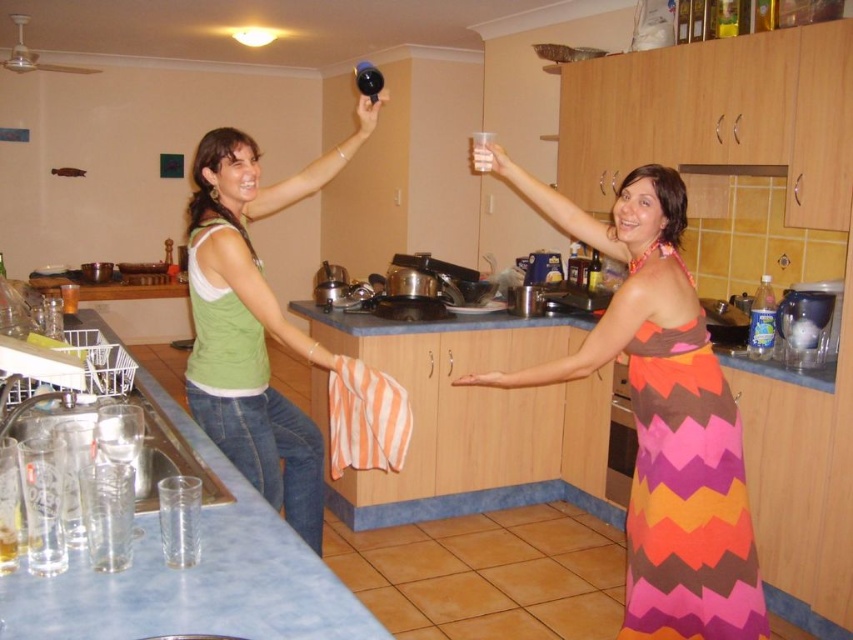
In the scene shown: Can you confirm if multicolored woven dress at center is positioned above matte plastic cup at upper center?

Incorrect, multicolored woven dress at center is not positioned above matte plastic cup at upper center.

What do you see at coordinates (665, 419) in the screenshot? Image resolution: width=853 pixels, height=640 pixels. I see `multicolored woven dress at center` at bounding box center [665, 419].

The image size is (853, 640). Describe the element at coordinates (665, 419) in the screenshot. I see `multicolored woven dress at center` at that location.

At what (x,y) coordinates should I click in order to perform the action: click on multicolored woven dress at center. Please return your answer as a coordinate pair (x, y). This screenshot has height=640, width=853. Looking at the image, I should click on (665, 419).

Is point (259, 436) less distant than point (488, 374)?

No, it is not.

Does green fabric tank top at upper left have a greater height compared to pink fabric hand at center?

Yes.

This screenshot has height=640, width=853. Identify the location of green fabric tank top at upper left. (251, 326).

Which is below, multicolored woven dress at center or pink fabric hand at center?

multicolored woven dress at center is below.

Image resolution: width=853 pixels, height=640 pixels. I want to click on multicolored woven dress at center, so click(665, 419).